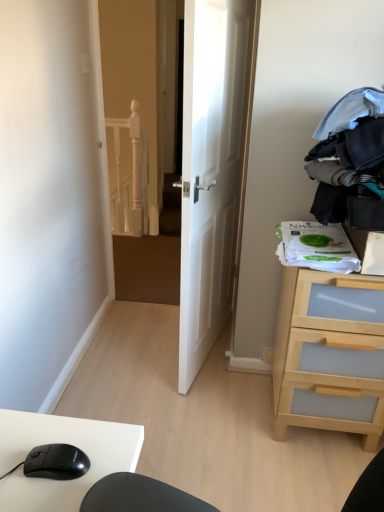
I want to click on free location to the left of light wood/transparent drawer at right, so click(x=237, y=421).